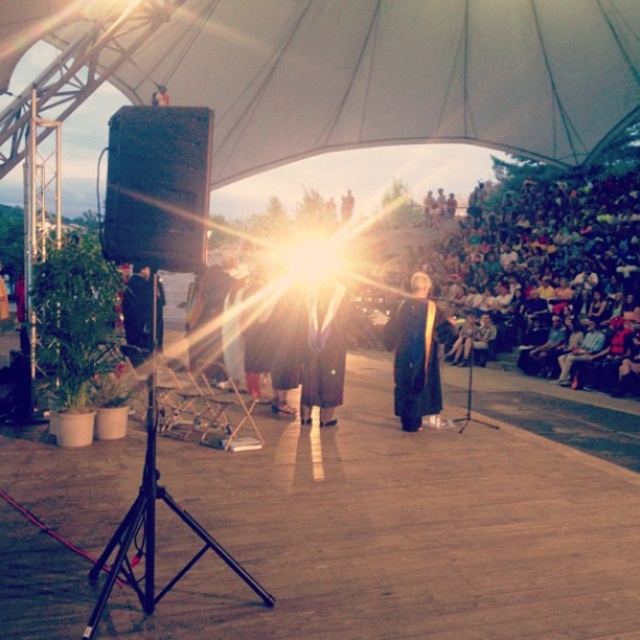
Between black metal tripod at left and matte black gown at center, which one appears on the right side from the viewer's perspective?

From the viewer's perspective, matte black gown at center appears more on the right side.

Identify the location of black metal tripod at left. This screenshot has width=640, height=640. (152, 516).

Does point (145, 492) come behind point (326, 365)?

No, (145, 492) is in front of (326, 365).

Identify the location of black metal tripod at left. This screenshot has width=640, height=640. (152, 516).

Is white fabric canopy at upper center above black metal tripod at left?

Indeed, white fabric canopy at upper center is positioned over black metal tripod at left.

Does white fabric canopy at upper center appear on the right side of black metal tripod at left?

Correct, you'll find white fabric canopy at upper center to the right of black metal tripod at left.

Does point (352, 118) come behind point (99, 616)?

Yes, it is behind point (99, 616).

Where is `white fabric canopy at upper center`? The width and height of the screenshot is (640, 640). white fabric canopy at upper center is located at coordinates (394, 74).

Can you confirm if wooden stage at center is positioned to the left of black matte gown at center?

Yes, wooden stage at center is to the left of black matte gown at center.

Between wooden stage at center and black matte gown at center, which one appears on the right side from the viewer's perspective?

black matte gown at center

Who is more forward, (532, 497) or (433, 364)?

Point (532, 497) is more forward.

Locate an element on the screen. The width and height of the screenshot is (640, 640). wooden stage at center is located at coordinates (x=401, y=534).